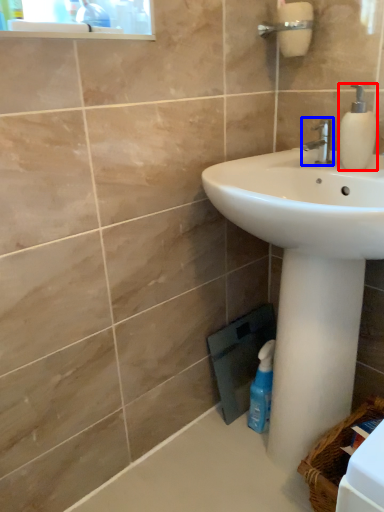
Question: Which of the following is the closest to the observer, soap dispenser (highlighted by a red box) or tap (highlighted by a blue box)?

Choices:
 (A) soap dispenser
 (B) tap

Answer: (A)